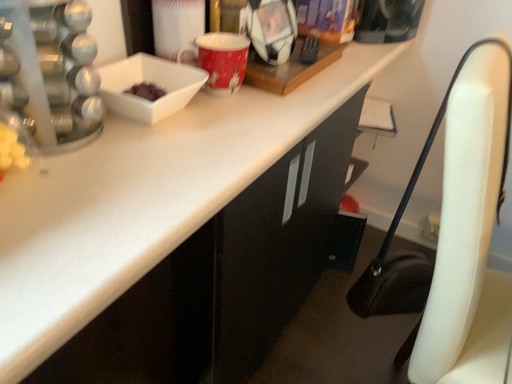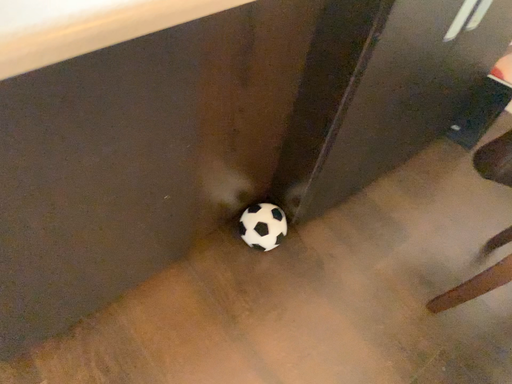
Question: How did the camera likely rotate when shooting the video?

Choices:
 (A) rotated left
 (B) rotated right

Answer: (A)